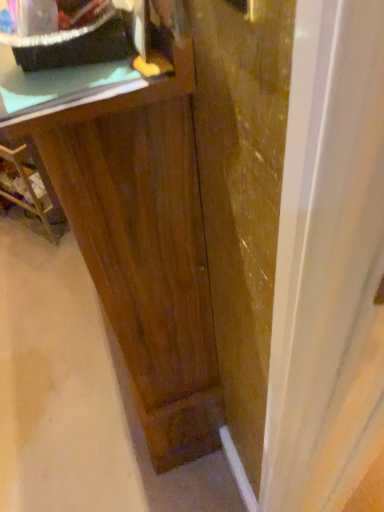
Question: Is transparent glass door at center directly adjacent to dark wood vanity at center?

Choices:
 (A) no
 (B) yes

Answer: (A)

Question: From a real-world perspective, is transparent glass door at center physically above dark wood vanity at center?

Choices:
 (A) yes
 (B) no

Answer: (A)

Question: Is transparent glass door at center shorter than dark wood vanity at center?

Choices:
 (A) yes
 (B) no

Answer: (B)

Question: Does transparent glass door at center appear on the left side of dark wood vanity at center?

Choices:
 (A) no
 (B) yes

Answer: (A)

Question: From the image's perspective, is transparent glass door at center over dark wood vanity at center?

Choices:
 (A) yes
 (B) no

Answer: (B)

Question: Can you confirm if transparent glass door at center is bigger than dark wood vanity at center?

Choices:
 (A) no
 (B) yes

Answer: (A)

Question: Is dark wood vanity at center located outside green matte counter top at upper left?

Choices:
 (A) no
 (B) yes

Answer: (B)

Question: Is dark wood vanity at center with green matte counter top at upper left?

Choices:
 (A) no
 (B) yes

Answer: (A)

Question: Can you confirm if dark wood vanity at center is positioned to the left of green matte counter top at upper left?

Choices:
 (A) yes
 (B) no

Answer: (A)

Question: Considering the relative positions of dark wood vanity at center and green matte counter top at upper left in the image provided, is dark wood vanity at center in front of green matte counter top at upper left?

Choices:
 (A) no
 (B) yes

Answer: (B)

Question: Considering the relative sizes of dark wood vanity at center and green matte counter top at upper left in the image provided, is dark wood vanity at center smaller than green matte counter top at upper left?

Choices:
 (A) yes
 (B) no

Answer: (B)

Question: From the image's perspective, does dark wood vanity at center appear higher than green matte counter top at upper left?

Choices:
 (A) no
 (B) yes

Answer: (A)

Question: From the image's perspective, is green matte counter top at upper left located beneath dark wood vanity at center?

Choices:
 (A) yes
 (B) no

Answer: (B)